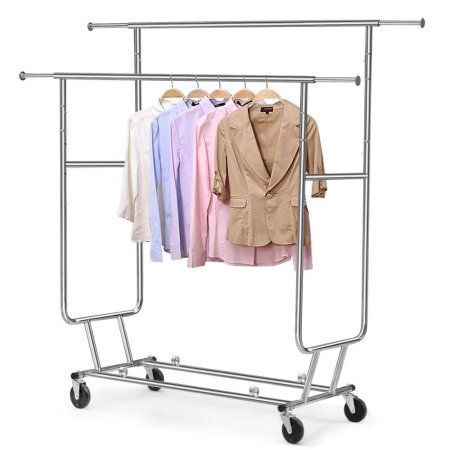
I want to click on hanger, so click(x=269, y=95), click(x=243, y=95), click(x=219, y=95), click(x=195, y=93), click(x=171, y=93).